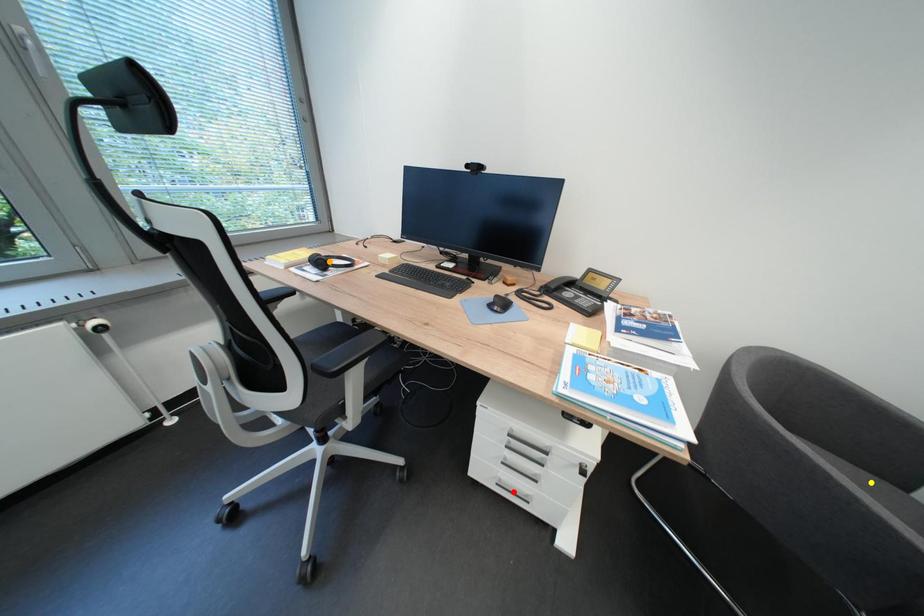
Order these from nearest to farthest:
- yellow point
- red point
- orange point

1. yellow point
2. red point
3. orange point